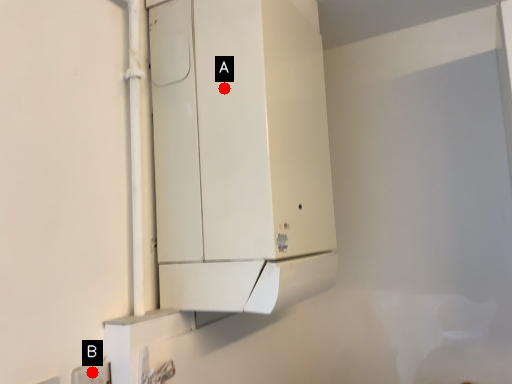
Question: Two points are circled on the image, labeled by A and B beside each circle. Which point appears closest to the camera in this image?

Choices:
 (A) A is closer
 (B) B is closer

Answer: (B)